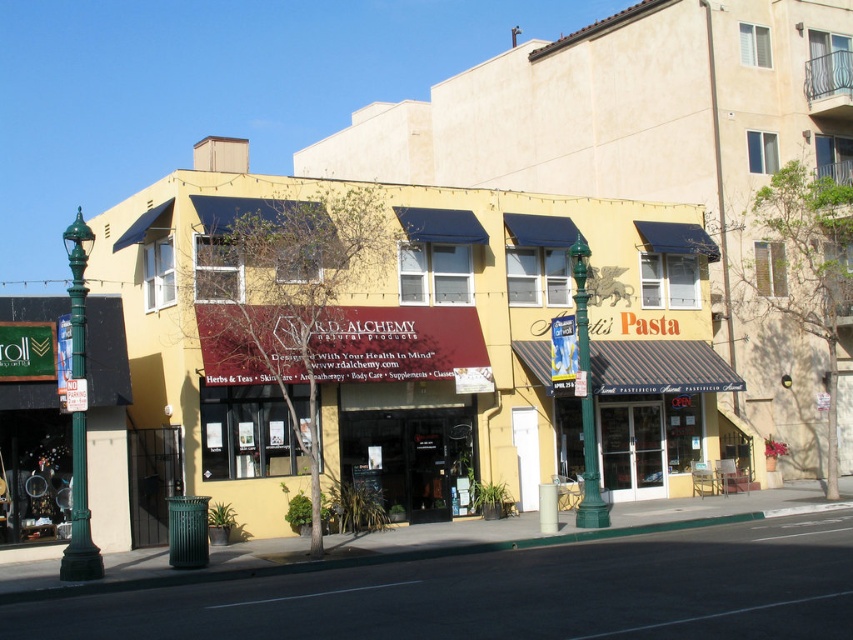
Is green polished metal streetlight at left positioned before green metal pole at center?

Yes, it is in front of green metal pole at center.

Who is lower down, green polished metal streetlight at left or green metal pole at center?

Positioned lower is green metal pole at center.

Describe the element at coordinates (80, 515) in the screenshot. The height and width of the screenshot is (640, 853). I see `green polished metal streetlight at left` at that location.

I want to click on green polished metal streetlight at left, so click(x=80, y=515).